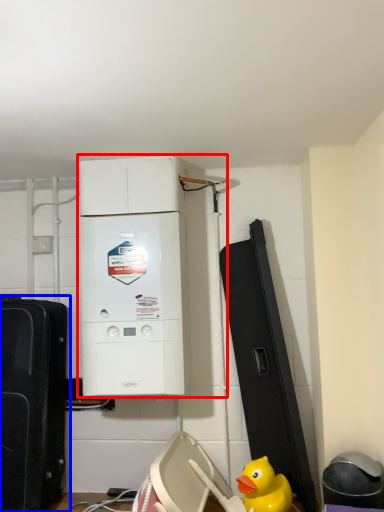
Question: Which object is closer to the camera taking this photo, home appliance (highlighted by a red box) or toy (highlighted by a blue box)?

Choices:
 (A) home appliance
 (B) toy

Answer: (B)